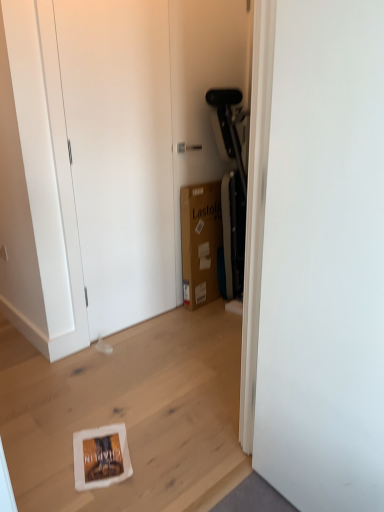
The image size is (384, 512). I want to click on vacant area in front of matte white dresser at center, so click(151, 370).